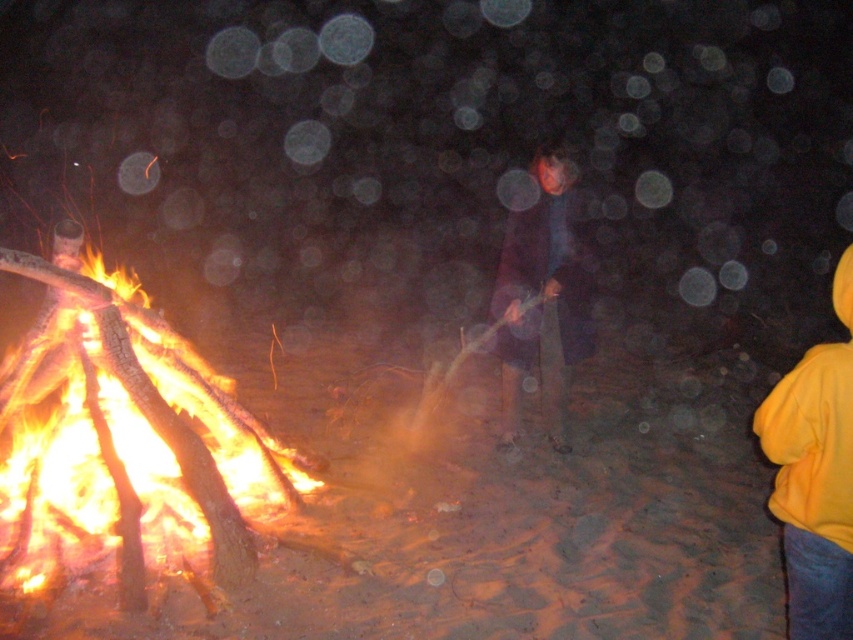
Does flaming wood fire at left have a smaller size compared to dark blue fabric at center?

Actually, flaming wood fire at left might be larger than dark blue fabric at center.

Is flaming wood fire at left bigger than dark blue fabric at center?

Correct, flaming wood fire at left is larger in size than dark blue fabric at center.

Does point (51, 406) lie in front of point (521, 355)?

No, (51, 406) is further to viewer.

Identify the location of flaming wood fire at left. Image resolution: width=853 pixels, height=640 pixels. (125, 440).

The height and width of the screenshot is (640, 853). What do you see at coordinates (815, 476) in the screenshot?
I see `yellow fleece jacket at lower right` at bounding box center [815, 476].

Is point (804, 500) more distant than point (515, 268)?

No, it is in front of (515, 268).

Find the location of a particular element. yellow fleece jacket at lower right is located at coordinates (815, 476).

Can you confirm if flaming wood fire at left is positioned to the right of yellow fleece jacket at lower right?

In fact, flaming wood fire at left is to the left of yellow fleece jacket at lower right.

Is point (61, 387) positioned after point (784, 460)?

Yes, it is behind point (784, 460).

Where is `flaming wood fire at left`? flaming wood fire at left is located at coordinates (125, 440).